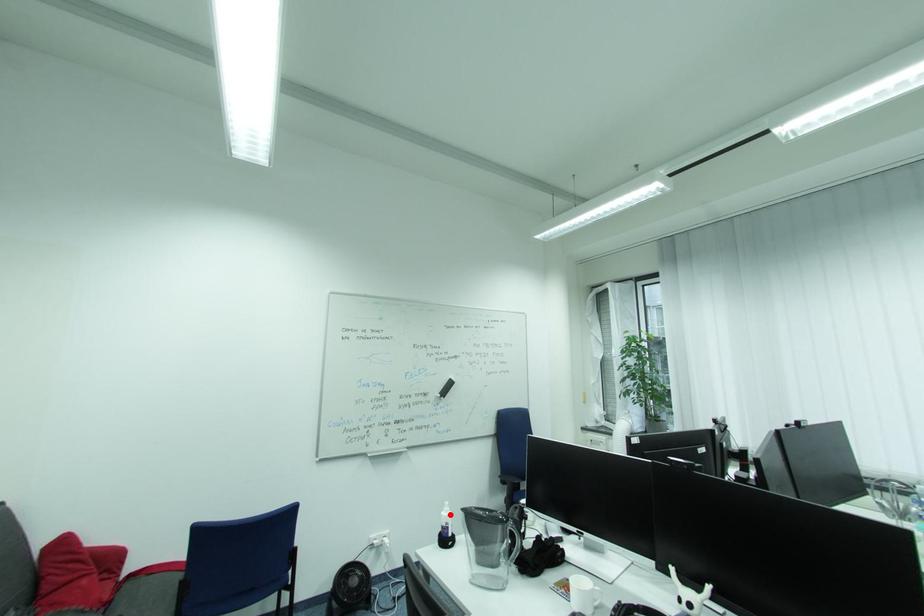
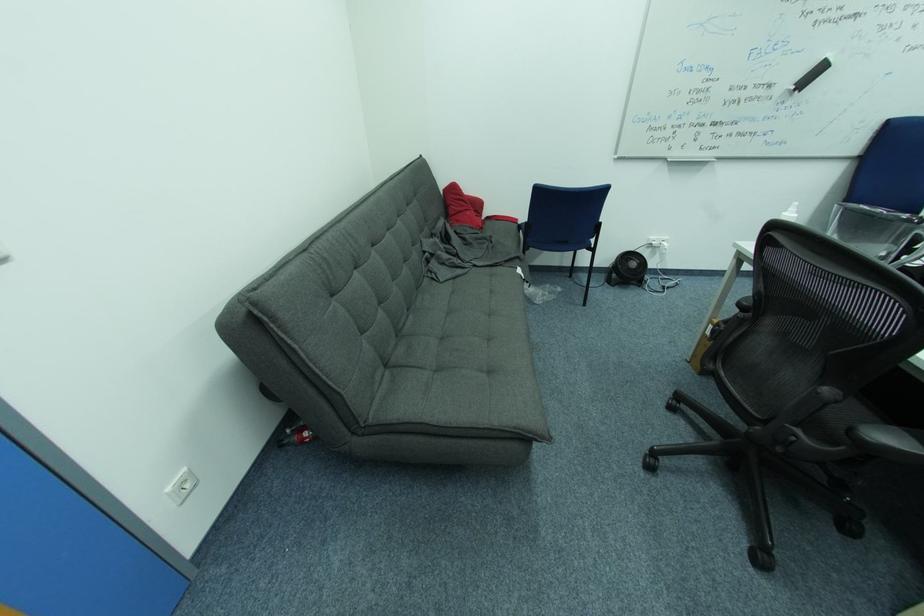
Question: A red point is marked in image1. In image2, is the corresponding 3D point closer to the camera or farther? Reply with the corresponding letter.

Choices:
 (A) The corresponding 3D point is closer.
 (B) The corresponding 3D point is farther.

Answer: (A)